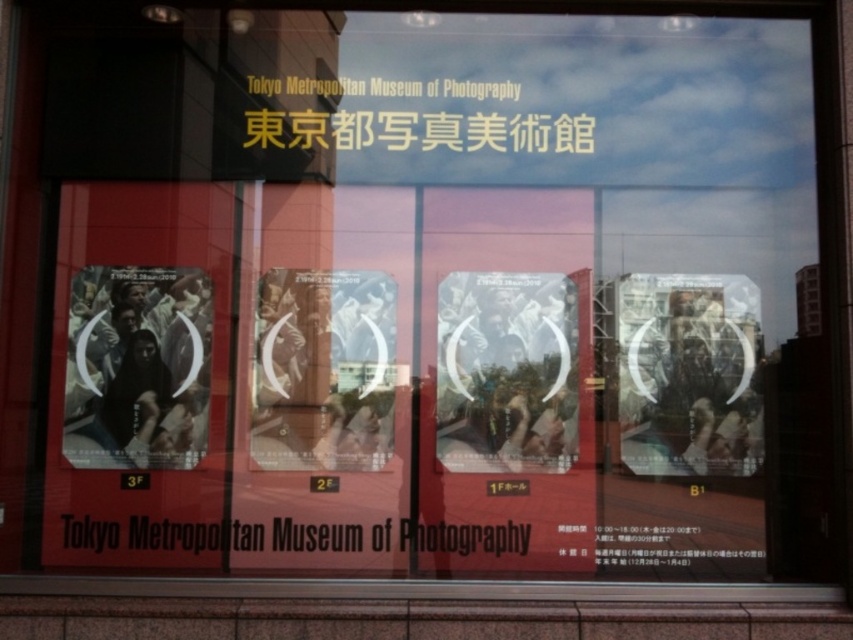
You are a visitor standing in front of the museum window. You see the matte black poster at right and the matte paper poster at center. Which poster is closer to the bottom edge of the window?

The matte black poster at right is positioned under the matte paper poster at center, so it is closer to the bottom edge of the window.

You are standing in front of the Tokyo Metropolitan Museum of Photography and want to locate the matte paper poster at lower left. What are the coordinates where you can find it?

The matte paper poster at lower left can be found at coordinates point (x=137, y=368).

You are standing in front of the Tokyo Metropolitan Museum of Photography and notice two posters on the front window advertisement. One is a matte black poster at right and the other is a matte paper poster at lower left. Which poster is positioned to the right side of the other?

The matte black poster at right is positioned to the right of the matte paper poster at lower left.